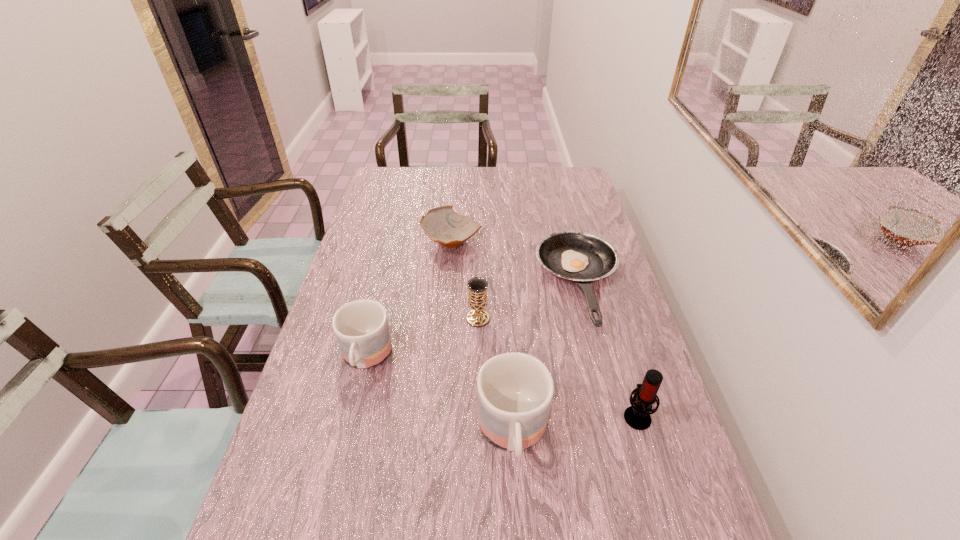
In the current image, all mugs are evenly spaced. To maintain this equal spacing, where should an additional mug be placed on the right? Please point out a free spot. Please provide its 2D coordinates. Your answer should be formatted as a tuple, i.e. [(x, y)], where the tuple contains the x and y coordinates of a point satisfying the conditions above.

[(716, 538)]